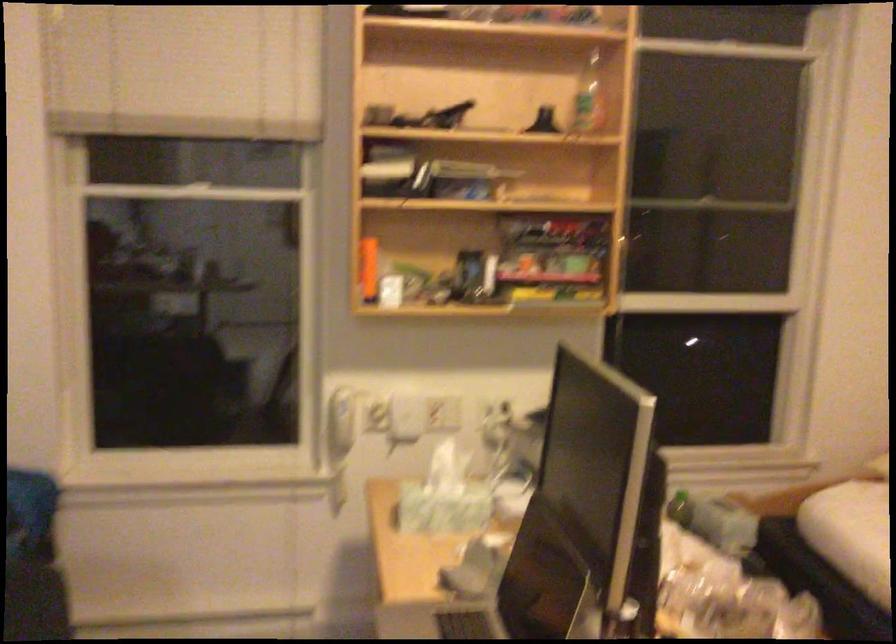
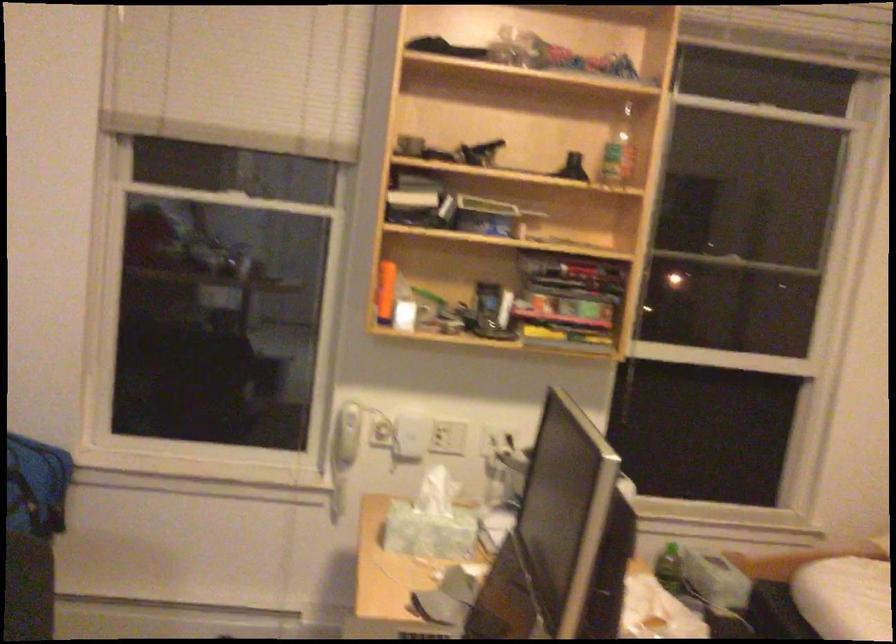
Where in the second image is the point corresponding to point (474, 281) from the first image?

(489, 313)